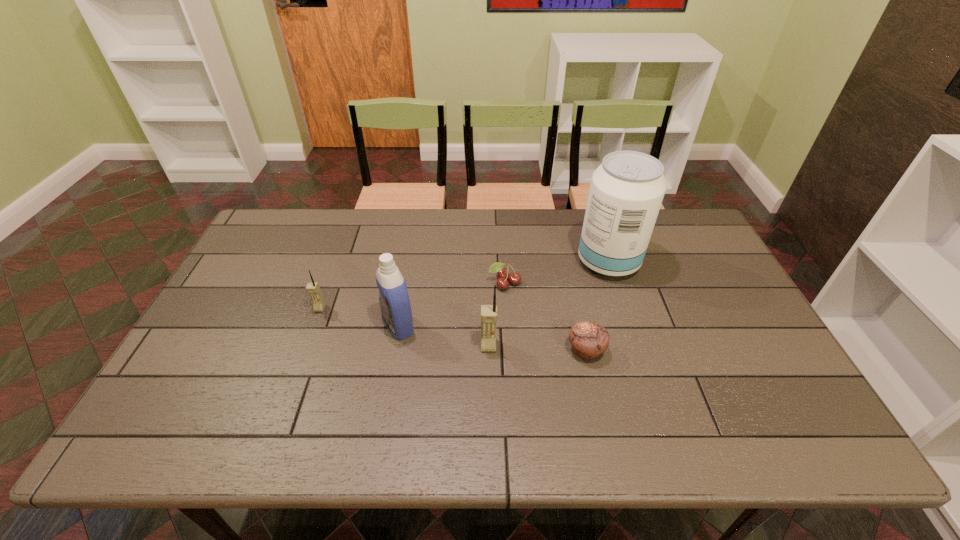
Identify the location of vacant space located on the front of the alcohol. (629, 326).

Locate an element on the screen. The height and width of the screenshot is (540, 960). free space located 0.130m on the back of the detergent is located at coordinates [x=407, y=278].

Find the location of a particular element. The width and height of the screenshot is (960, 540). free spot located on the leaves of the cherry is located at coordinates (506, 305).

I want to click on vacant area located on the back of the muffin, so click(x=572, y=287).

Image resolution: width=960 pixels, height=540 pixels. Find the location of `object present at the far edge`. object present at the far edge is located at coordinates (626, 192).

I want to click on vacant space at the far edge of the desktop, so click(384, 249).

In the image, there is a desktop. Where is `vacant space at the near edge`? vacant space at the near edge is located at coordinates (581, 386).

Locate an element on the screen. vacant space at the left edge is located at coordinates (289, 266).

Find the location of a particular element. vacant space at the right edge of the desktop is located at coordinates [735, 306].

Where is `vacant space at the far left corner of the desktop`? This screenshot has height=540, width=960. vacant space at the far left corner of the desktop is located at coordinates (278, 237).